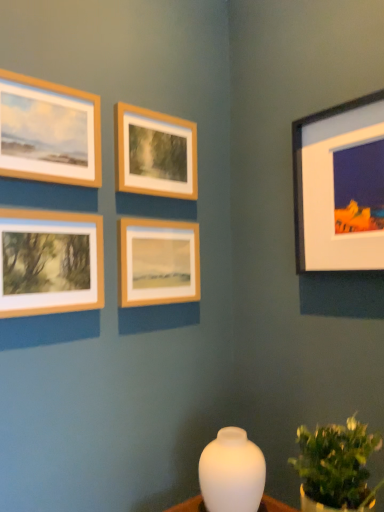
Question: Does matte wooden frame at lower left, the 4th picture frame in the right-to-left sequence, lie behind wooden frame at upper center, which is counted as the third picture frame, starting from the left?

Choices:
 (A) yes
 (B) no

Answer: (B)

Question: Is matte wooden frame at lower left, the 4th picture frame in the right-to-left sequence, directly adjacent to wooden frame at upper center, which is counted as the third picture frame, starting from the left?

Choices:
 (A) no
 (B) yes

Answer: (A)

Question: Does matte wooden frame at lower left, acting as the 2th picture frame starting from the left, have a larger size compared to wooden frame at upper center, which is counted as the 3th picture frame, starting from the right?

Choices:
 (A) no
 (B) yes

Answer: (B)

Question: Is matte wooden frame at lower left, acting as the 2th picture frame starting from the left, not within wooden frame at upper center, which is counted as the third picture frame, starting from the left?

Choices:
 (A) no
 (B) yes

Answer: (B)

Question: From the image's perspective, is matte wooden frame at lower left, the 4th picture frame in the right-to-left sequence, located beneath wooden frame at upper center, which is counted as the third picture frame, starting from the left?

Choices:
 (A) no
 (B) yes

Answer: (B)

Question: Considering the positions of point (292, 167) and point (1, 246), is point (292, 167) closer or farther from the camera than point (1, 246)?

Choices:
 (A) closer
 (B) farther

Answer: (B)

Question: Considering the positions of black matte frame at upper right, marked as the 5th picture frame in a left-to-right arrangement, and matte wooden frame at lower left, acting as the 2th picture frame starting from the left, in the image, is black matte frame at upper right, marked as the 5th picture frame in a left-to-right arrangement, wider or thinner than matte wooden frame at lower left, acting as the 2th picture frame starting from the left,?

Choices:
 (A) thin
 (B) wide

Answer: (B)

Question: Visually, is black matte frame at upper right, marked as the 5th picture frame in a left-to-right arrangement, positioned to the left or to the right of matte wooden frame at lower left, the 4th picture frame in the right-to-left sequence?

Choices:
 (A) right
 (B) left

Answer: (A)

Question: Looking at the image, does black matte frame at upper right, marked as the 5th picture frame in a left-to-right arrangement, seem bigger or smaller compared to matte wooden frame at lower left, acting as the 2th picture frame starting from the left?

Choices:
 (A) small
 (B) big

Answer: (B)

Question: From the image's perspective, is wooden frame at center, the fourth picture frame viewed from the left, above or below black matte frame at upper right, the first picture frame positioned from the right?

Choices:
 (A) above
 (B) below

Answer: (B)

Question: Do you think wooden frame at center, the fourth picture frame viewed from the left, is within black matte frame at upper right, the first picture frame positioned from the right, or outside of it?

Choices:
 (A) outside
 (B) inside

Answer: (A)

Question: In terms of height, does wooden frame at center, which ranks as the second picture frame in right-to-left order, look taller or shorter compared to black matte frame at upper right, marked as the 5th picture frame in a left-to-right arrangement?

Choices:
 (A) tall
 (B) short

Answer: (B)

Question: Is point (168, 285) positioned closer to the camera than point (377, 224)?

Choices:
 (A) closer
 (B) farther

Answer: (B)

Question: From the image's perspective, is wooden frame at upper left, the 1th picture frame positioned from the left, above or below green leafy plant at lower right?

Choices:
 (A) above
 (B) below

Answer: (A)

Question: In terms of height, does wooden frame at upper left, the fifth picture frame when ordered from right to left, look taller or shorter compared to green leafy plant at lower right?

Choices:
 (A) tall
 (B) short

Answer: (B)